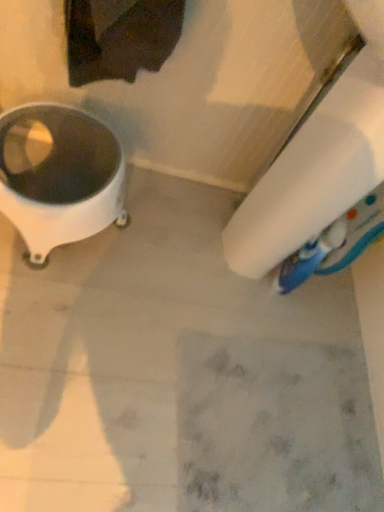
The height and width of the screenshot is (512, 384). Identify the location of free spot to the right of white glossy waste container at left. coord(155,283).